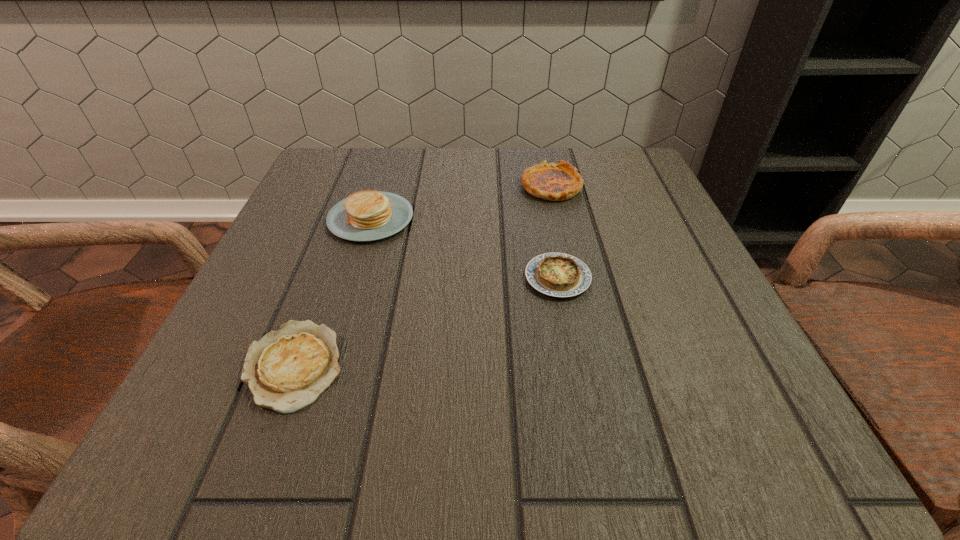
At what (x,y) coordinates should I click in order to perform the action: click on blank region between the tallest object and the leftmost quiche. Please return your answer as a coordinate pair (x, y). Looking at the image, I should click on (332, 292).

This screenshot has height=540, width=960. I want to click on free space between the third shortest object and the leftmost quiche, so click(422, 275).

Image resolution: width=960 pixels, height=540 pixels. I want to click on blank region between the second nearest quiche and the farthest quiche, so click(555, 232).

I want to click on free space between the farthest quiche and the second nearest quiche, so click(555, 232).

This screenshot has width=960, height=540. In order to click on empty space that is in between the farthest quiche and the pancake in this screenshot , I will do `click(461, 202)`.

I want to click on free space between the second nearest object and the shortest quiche, so click(425, 321).

Where is `object identified as the closest to the farthest quiche`? object identified as the closest to the farthest quiche is located at coordinates (555, 274).

Locate which object ranks second in proximity to the second tallest object. Please provide its 2D coordinates. Your answer should be formatted as a tuple, i.e. [(x, y)], where the tuple contains the x and y coordinates of a point satisfying the conditions above.

[(369, 215)]

I want to click on quiche identified as the second closest to the tallest quiche, so click(286, 370).

Choose which quiche is the nearest neighbor to the nearest quiche. Please provide its 2D coordinates. Your answer should be formatted as a tuple, i.e. [(x, y)], where the tuple contains the x and y coordinates of a point satisfying the conditions above.

[(555, 274)]